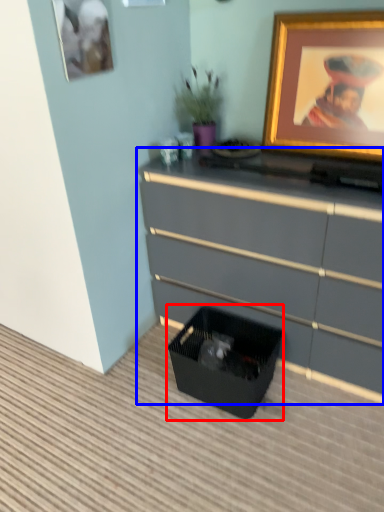
Question: Which of the following is the closest to the observer, storage box (highlighted by a red box) or chest of drawers (highlighted by a blue box)?

Choices:
 (A) storage box
 (B) chest of drawers

Answer: (B)